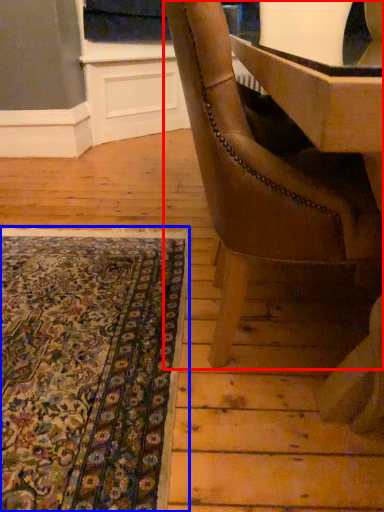
Question: Among these objects, which one is nearest to the camera, chair (highlighted by a red box) or mat (highlighted by a blue box)?

Choices:
 (A) chair
 (B) mat

Answer: (A)